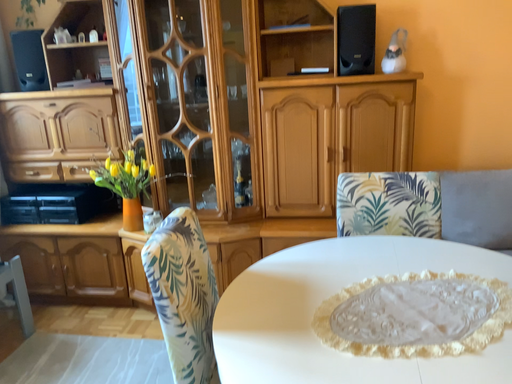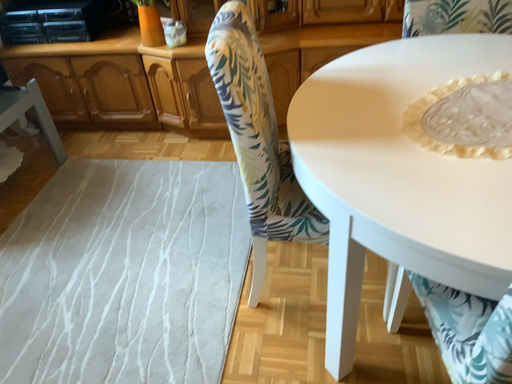
Question: How did the camera likely rotate when shooting the video?

Choices:
 (A) rotated upward
 (B) rotated downward

Answer: (B)